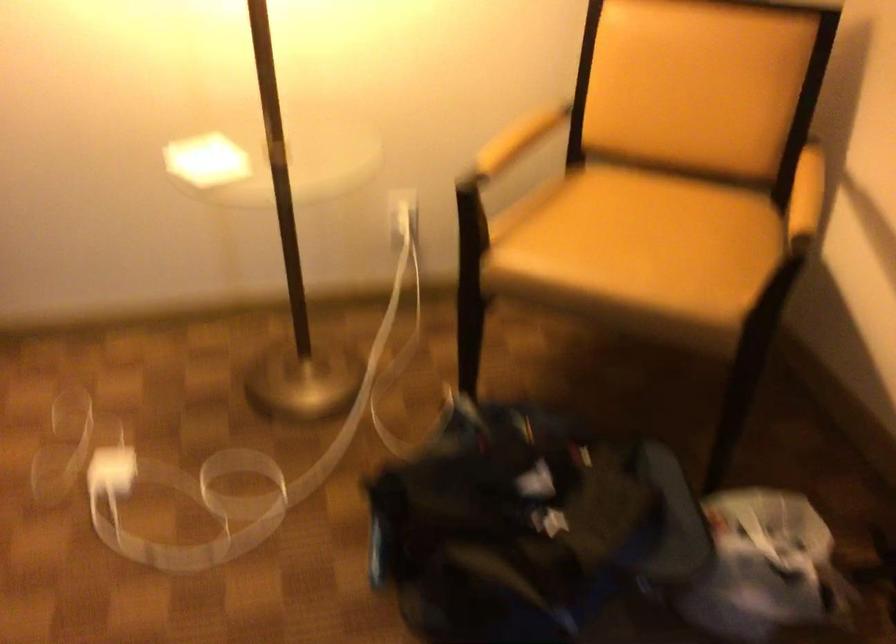
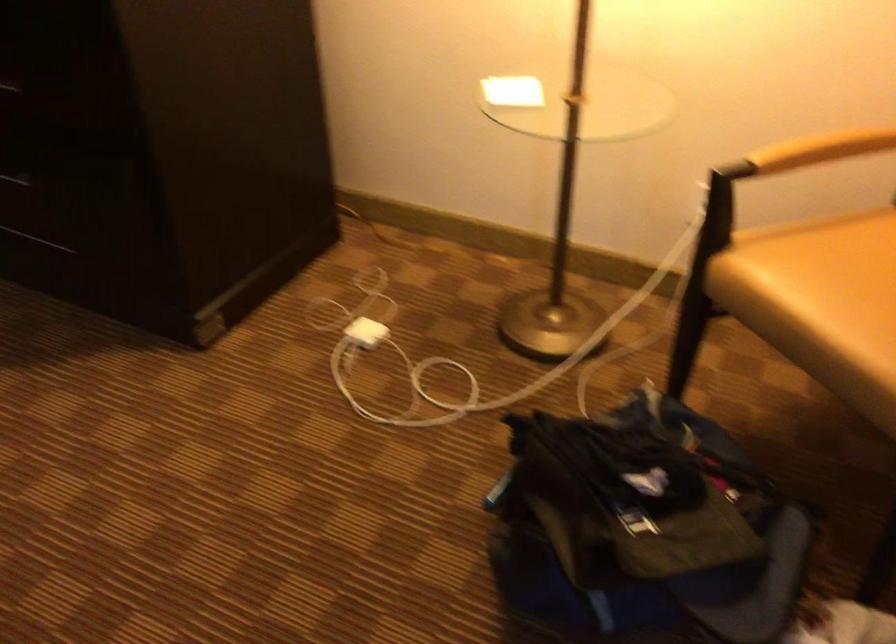
Find the pixel in the second image that matches (x=213, y=149) in the first image.

(513, 91)